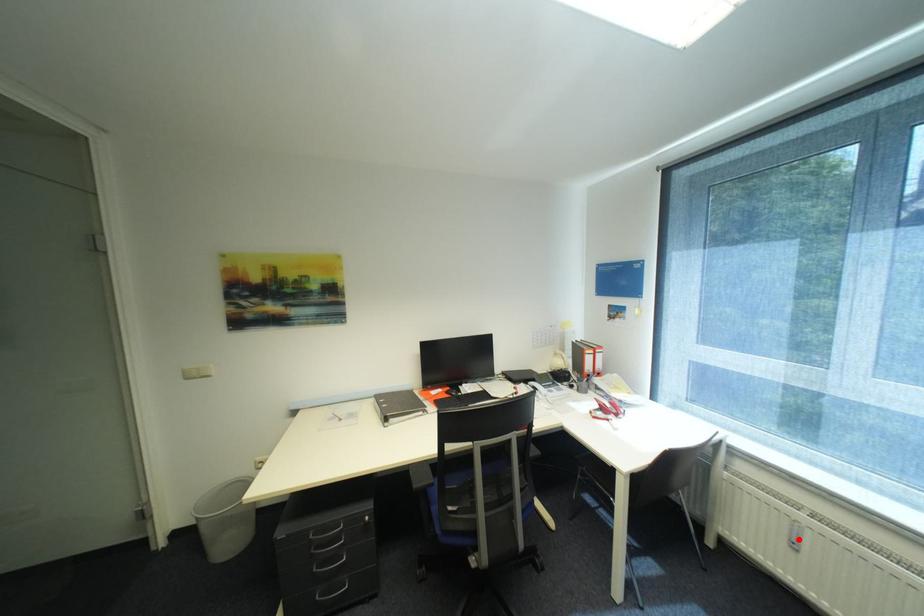
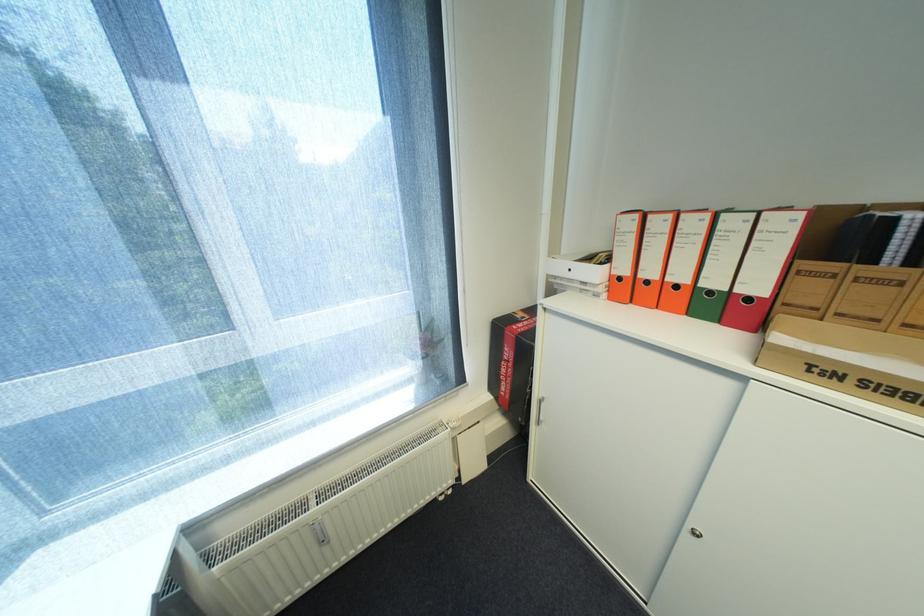
Find the pixel in the second image that matches the highlighted location in the first image.

(326, 541)